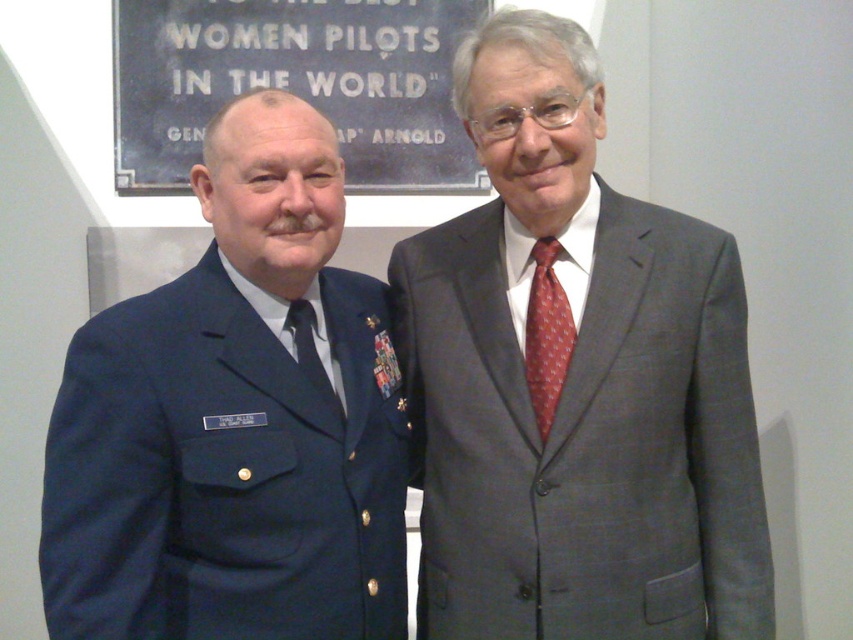
You are a photographer setting up for a group photo. You notice the gray suit at center and the black silk tie at center in the scene. Which item will appear larger in the final photo?

The gray suit at center will appear larger in the final photo because it is taller than the black silk tie at center.

Based on the scene description, which object is positioned higher in the image, the gray suit at center or the navy blue uniform at left?

The gray suit at center is positioned higher in the image than the navy blue uniform at left according to the description.